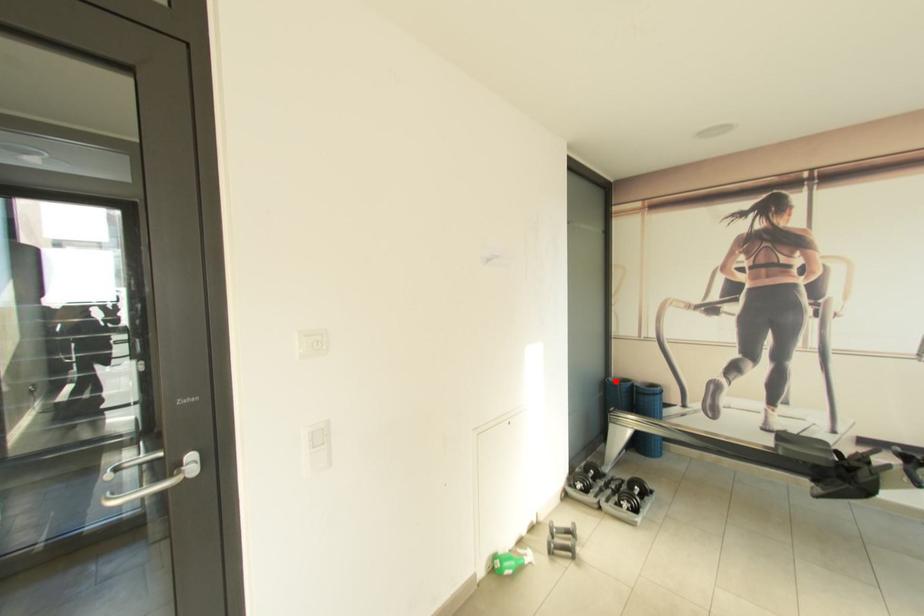
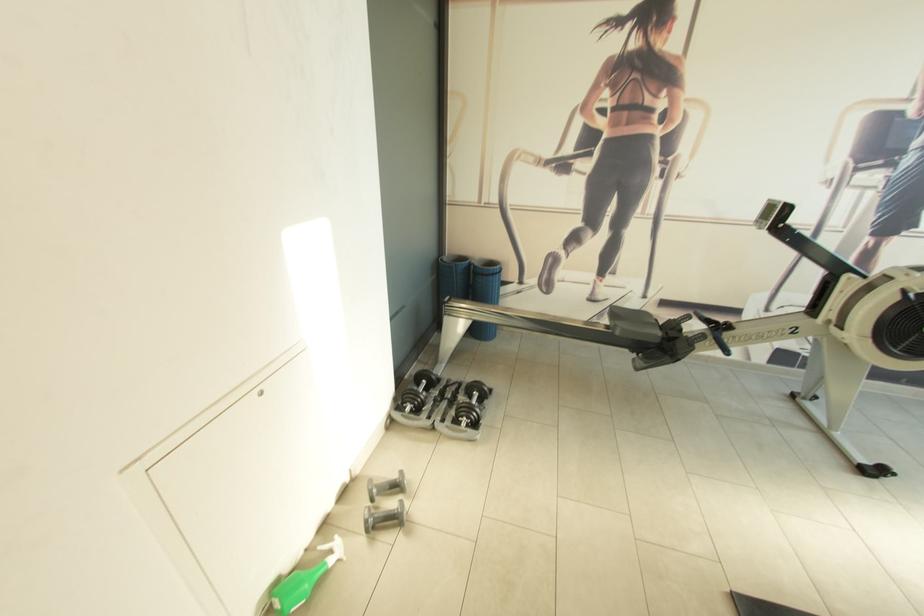
The point at the highlighted location is marked in the first image. Where is the corresponding point in the second image?

(451, 261)